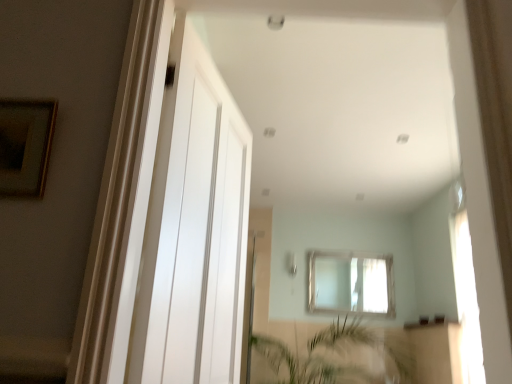
Locate an element on the screen. The width and height of the screenshot is (512, 384). free spot below clear glass window at center (from a real-world perspective) is located at coordinates (345, 321).